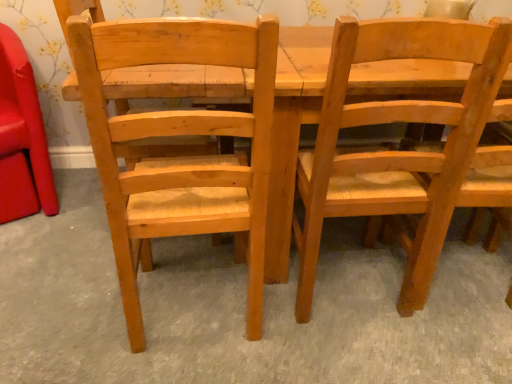
Question: Can you confirm if matte wood chair at left, which is the first chair from left to right, is bigger than light brown wood chair at center, the 3th chair in the left-to-right sequence?

Choices:
 (A) yes
 (B) no

Answer: (B)

Question: Considering the relative sizes of matte wood chair at left, which appears as the 3th chair when viewed from the right, and light brown wood chair at center, acting as the first chair starting from the right, in the image provided, is matte wood chair at left, which appears as the 3th chair when viewed from the right, smaller than light brown wood chair at center, acting as the first chair starting from the right,?

Choices:
 (A) no
 (B) yes

Answer: (B)

Question: Are matte wood chair at left, which is the first chair from left to right, and light brown wood chair at center, acting as the first chair starting from the right, far apart?

Choices:
 (A) yes
 (B) no

Answer: (A)

Question: Can you confirm if matte wood chair at left, which is the first chair from left to right, is positioned to the right of light brown wood chair at center, the 3th chair in the left-to-right sequence?

Choices:
 (A) yes
 (B) no

Answer: (B)

Question: Is the depth of matte wood chair at left, which appears as the 3th chair when viewed from the right, greater than that of light brown wood chair at center, acting as the first chair starting from the right?

Choices:
 (A) yes
 (B) no

Answer: (A)

Question: From a real-world perspective, is matte wood chair at left, which is the first chair from left to right, under light brown wood chair at center, acting as the first chair starting from the right?

Choices:
 (A) yes
 (B) no

Answer: (A)

Question: From a real-world perspective, does natural wood chair at left, marked as the second chair in a right-to-left arrangement, sit lower than matte wood chair at left, which appears as the 3th chair when viewed from the right?

Choices:
 (A) no
 (B) yes

Answer: (A)

Question: From a real-world perspective, is natural wood chair at left, which appears as the second chair when viewed from the left, physically above matte wood chair at left, which appears as the 3th chair when viewed from the right?

Choices:
 (A) yes
 (B) no

Answer: (A)

Question: Is natural wood chair at left, which appears as the second chair when viewed from the left, further to camera compared to matte wood chair at left, which is the first chair from left to right?

Choices:
 (A) no
 (B) yes

Answer: (A)

Question: Is natural wood chair at left, marked as the second chair in a right-to-left arrangement, to the right of matte wood chair at left, which is the first chair from left to right, from the viewer's perspective?

Choices:
 (A) no
 (B) yes

Answer: (B)

Question: Is natural wood chair at left, which appears as the second chair when viewed from the left, in contact with matte wood chair at left, which appears as the 3th chair when viewed from the right?

Choices:
 (A) no
 (B) yes

Answer: (A)

Question: Is natural wood chair at left, marked as the second chair in a right-to-left arrangement, positioned in front of matte wood chair at left, which appears as the 3th chair when viewed from the right?

Choices:
 (A) no
 (B) yes

Answer: (B)

Question: Considering the relative sizes of light brown wood chair at center, acting as the first chair starting from the right, and matte wood chair at left, which is the first chair from left to right, in the image provided, is light brown wood chair at center, acting as the first chair starting from the right, bigger than matte wood chair at left, which is the first chair from left to right,?

Choices:
 (A) no
 (B) yes

Answer: (B)